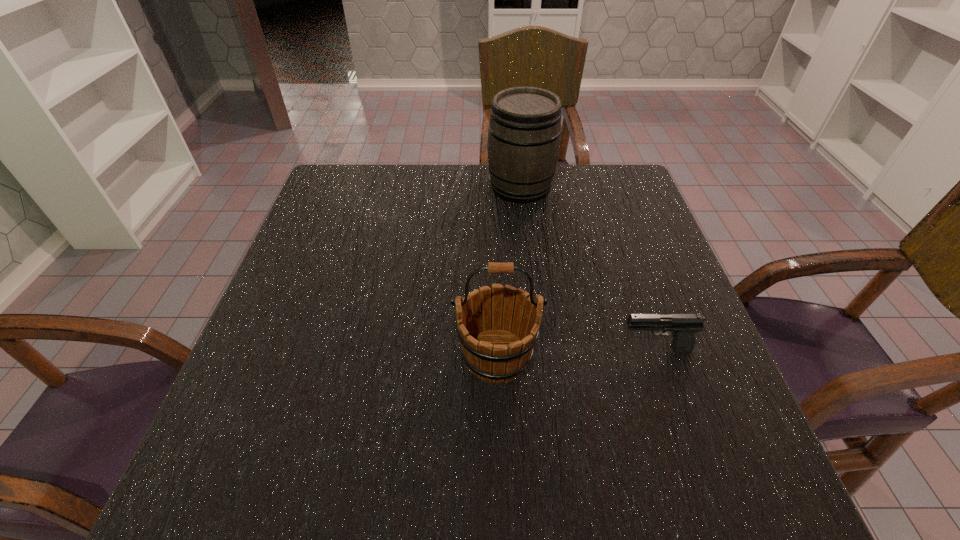
At what (x,y) coordinates should I click in order to perform the action: click on the farthest object. Please return your answer as a coordinate pair (x, y). Looking at the image, I should click on (524, 135).

Identify the location of the nearer wine bucket. (495, 349).

At what (x,y) coordinates should I click in order to perform the action: click on the rightmost object. Please return your answer as a coordinate pair (x, y). This screenshot has width=960, height=540. Looking at the image, I should click on (683, 327).

At what (x,y) coordinates should I click in order to perform the action: click on pistol. Please return your answer as a coordinate pair (x, y). This screenshot has width=960, height=540. Looking at the image, I should click on (683, 327).

Find the location of a particular element. blank area located 0.150m on the right of the farthest object is located at coordinates point(607,186).

Identify the location of vacant space located on the left of the nearer wine bucket. This screenshot has height=540, width=960. (310, 356).

Image resolution: width=960 pixels, height=540 pixels. What are the coordinates of `blank space located 0.260m aim along the barrel of the pistol` in the screenshot? It's located at (488, 349).

Locate an element on the screen. vacant space located 0.220m aim along the barrel of the pistol is located at coordinates (508, 349).

Identify the location of blank space located 0.260m aim along the barrel of the pistol. (488, 349).

Where is `object at the far edge`? The width and height of the screenshot is (960, 540). object at the far edge is located at coordinates (524, 135).